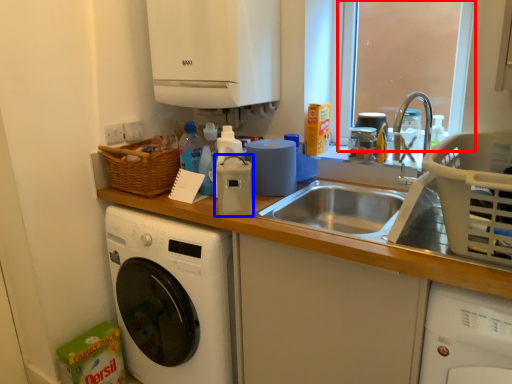
Question: Among these objects, which one is nearest to the camera, window screen (highlighted by a red box) or appliance (highlighted by a blue box)?

Choices:
 (A) window screen
 (B) appliance

Answer: (B)